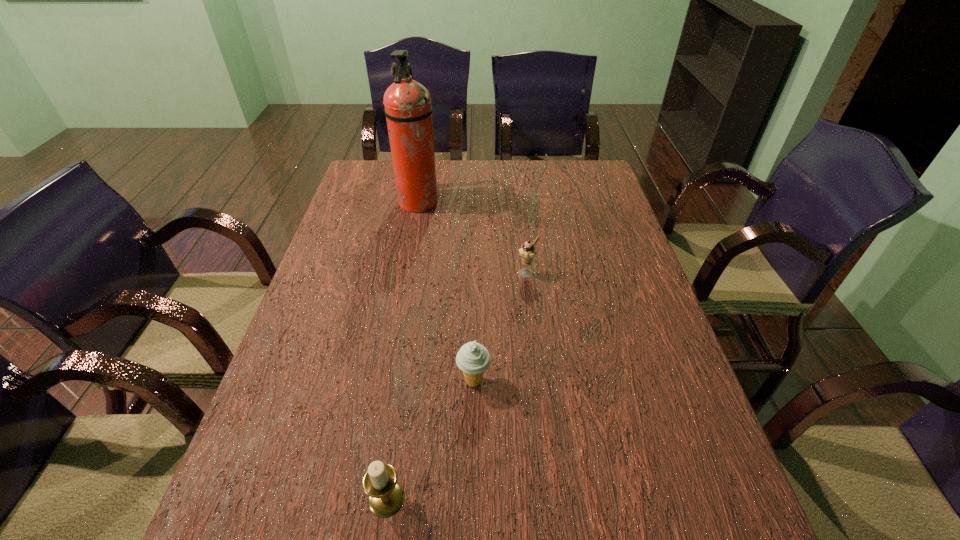
Locate an element on the screen. vacant space located on the left of the nearest object is located at coordinates (290, 498).

Locate an element on the screen. object situated at the far edge is located at coordinates (408, 110).

In order to click on free space at the far edge in this screenshot , I will do coord(554,164).

I want to click on free region at the left edge of the desktop, so pyautogui.click(x=342, y=242).

The image size is (960, 540). In the image, there is a desktop. Find the location of `free region at the right edge`. free region at the right edge is located at coordinates (659, 532).

In the image, there is a desktop. Find the location of `vacant space at the far left corner`. vacant space at the far left corner is located at coordinates (359, 170).

At what (x,y) coordinates should I click in order to perform the action: click on vacant space at the far right corner of the desktop. Please return your answer as a coordinate pair (x, y). Looking at the image, I should click on (588, 163).

What are the coordinates of `free area in between the nearer icecream and the farthest object` in the screenshot? It's located at point(445,292).

Locate an element on the screen. This screenshot has width=960, height=540. vacant space in between the third object from left to right and the fire extinguisher is located at coordinates (445, 292).

This screenshot has width=960, height=540. I want to click on free space between the nearest object and the farther icecream, so click(x=457, y=386).